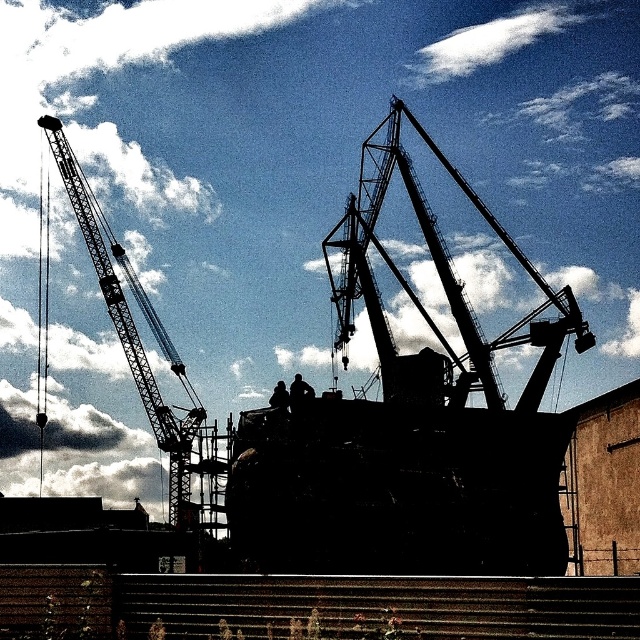
Does black matte boat at center have a greater height compared to silhouette metal crane at center?

Yes.

Image resolution: width=640 pixels, height=640 pixels. What do you see at coordinates (406, 426) in the screenshot?
I see `black matte boat at center` at bounding box center [406, 426].

Image resolution: width=640 pixels, height=640 pixels. In order to click on black matte boat at center in this screenshot , I will do `click(406, 426)`.

Looking at this image, which is more to the left, black matte boat at center or silhouette metal crane at left?

From the viewer's perspective, silhouette metal crane at left appears more on the left side.

Between point (371, 476) and point (170, 422), which one is positioned in front?

Point (371, 476) is in front.

Find the location of a particular element. The image size is (640, 640). black matte boat at center is located at coordinates (406, 426).

Can you confirm if silhouette metal crane at center is bigger than silhouette metal crane at left?

Correct, silhouette metal crane at center is larger in size than silhouette metal crane at left.

Is point (524, 326) positioned after point (182, 408)?

No, (524, 326) is in front of (182, 408).

This screenshot has height=640, width=640. Identify the location of silhouette metal crane at center. (440, 273).